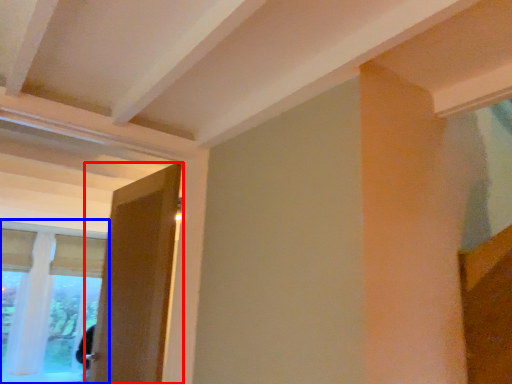
Question: Which point is further to the camera, door (highlighted by a red box) or window (highlighted by a blue box)?

Choices:
 (A) door
 (B) window

Answer: (B)